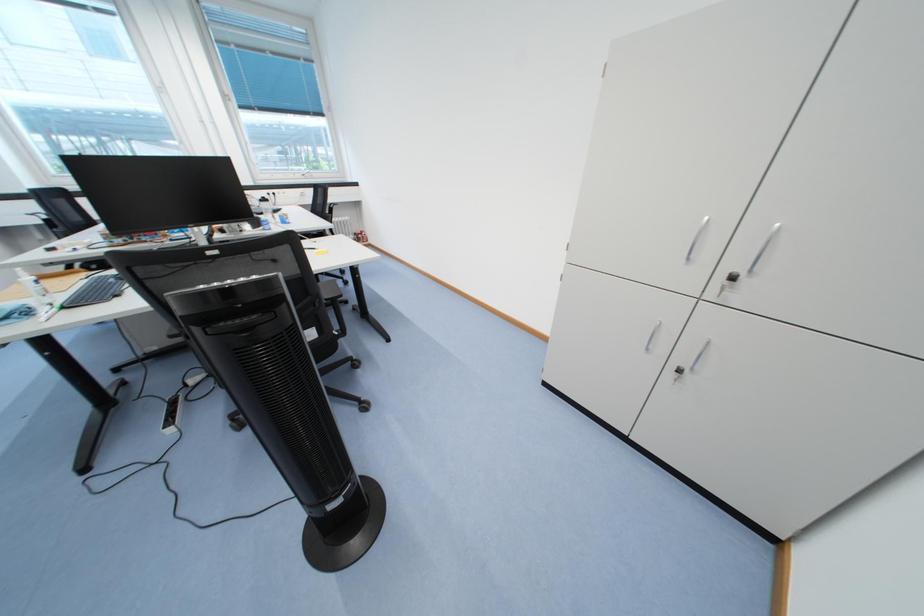
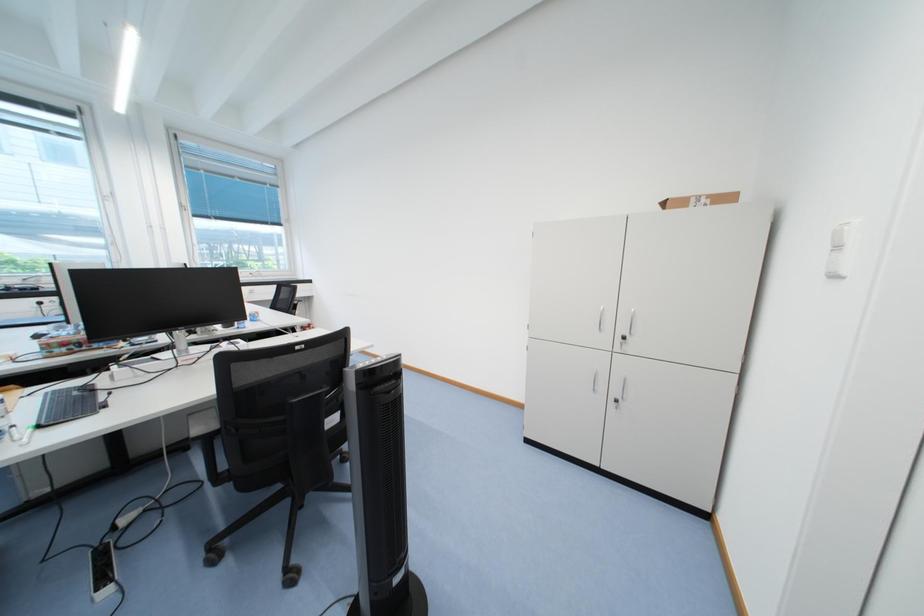
Consider the image. First-person continuous shooting, in which direction is the camera rotating?

The camera's rotation is toward right-up.